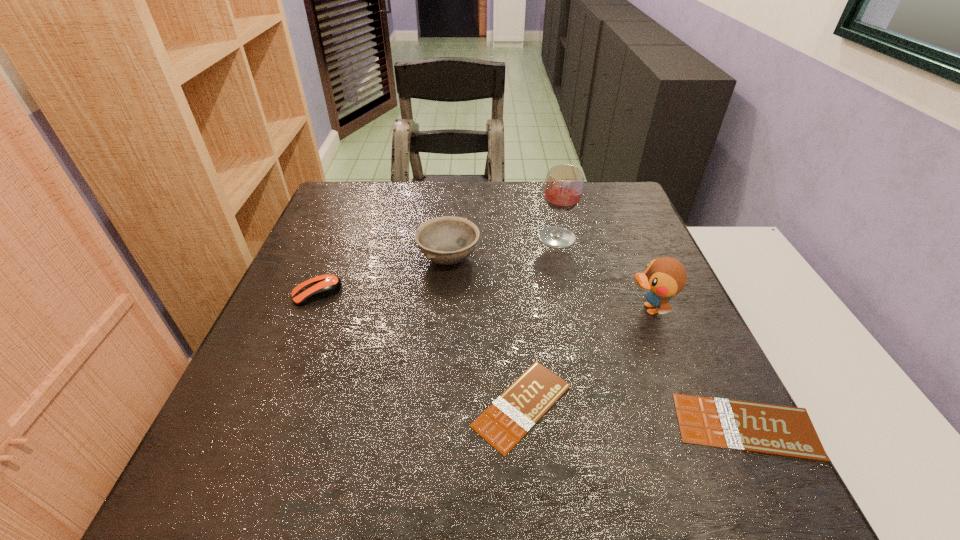
Find the location of a particular element. The height and width of the screenshot is (540, 960). vacant region that satisfies the following two spatial constraints: 1. on the front-facing side of the taller chocolate bar; 2. on the right side of the duck is located at coordinates (697, 426).

Find the location of a particular element. This screenshot has width=960, height=540. vacant region that satisfies the following two spatial constraints: 1. on the front side of the taller chocolate bar; 2. on the left side of the shorter chocolate bar is located at coordinates (524, 426).